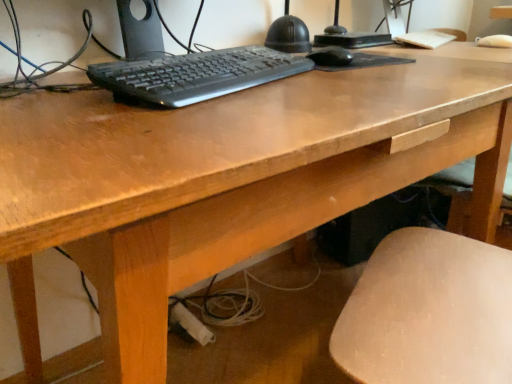
Locate an element on the screen. This screenshot has width=512, height=384. vacant space underneath black plastic keyboard at center (from a real-world perspective) is located at coordinates point(252,360).